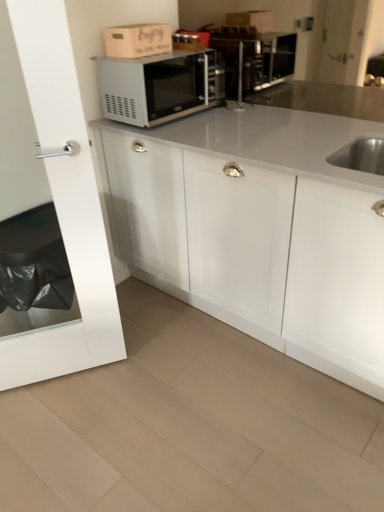
Locate an element on the screen. Image resolution: width=384 pixels, height=512 pixels. empty space that is ontop of white matte cabinet at center (from a real-world perspective) is located at coordinates (274, 129).